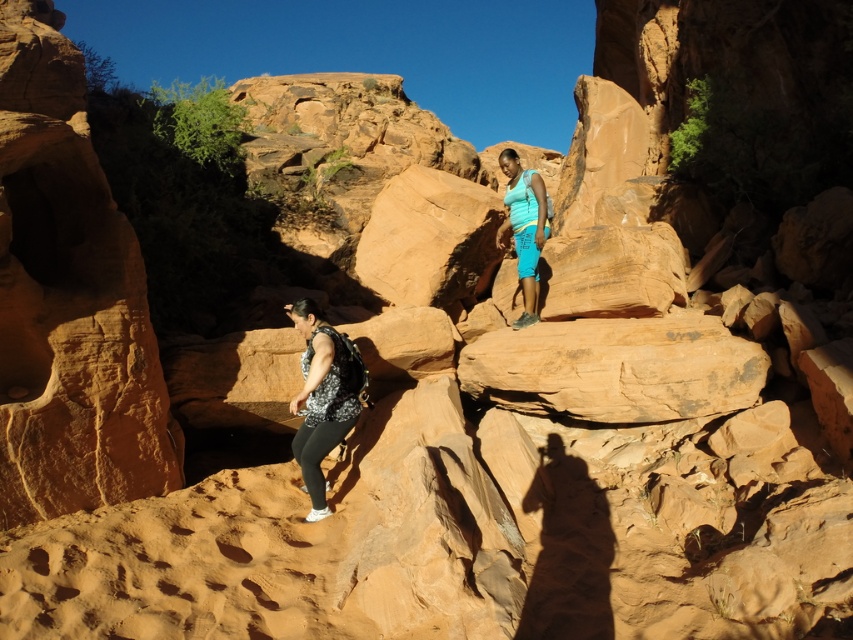
Question: Among these objects, which one is farthest from the camera?

Choices:
 (A) blue fabric shorts at center
 (B) floral-patterned fabric at center

Answer: (A)

Question: Observing the image, what is the correct spatial positioning of floral-patterned fabric at center in reference to blue fabric shorts at center?

Choices:
 (A) left
 (B) right

Answer: (A)

Question: Which object appears farthest from the camera in this image?

Choices:
 (A) blue fabric shorts at center
 (B) floral-patterned fabric at center

Answer: (A)

Question: Does floral-patterned fabric at center come behind blue fabric shorts at center?

Choices:
 (A) no
 (B) yes

Answer: (A)

Question: Does floral-patterned fabric at center appear on the left side of blue fabric shorts at center?

Choices:
 (A) yes
 (B) no

Answer: (A)